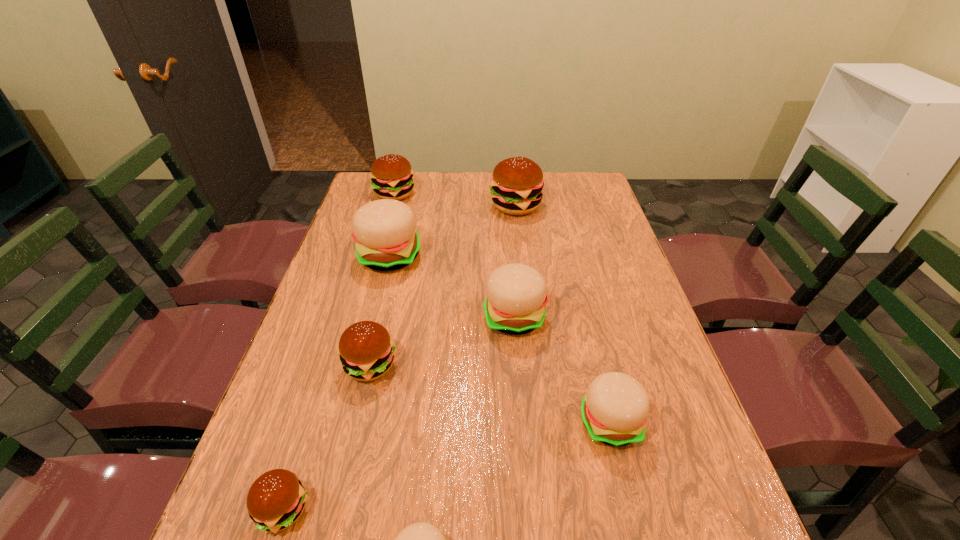
You are a GUI agent. You are given a task and a screenshot of the screen. Output one action in this format:
    pyautogui.click(x=<x>, y=<y>)
    Task: Click on the vacant region that satisfies the following two spatial constraints: 1. on the front side of the second nearest beige hamburger; 2. on the left side of the second biggest brown hamburger
    Image resolution: width=960 pixels, height=540 pixels.
    Given the screenshot: What is the action you would take?
    point(329,422)

I want to click on vacant point that satisfies the following two spatial constraints: 1. on the front side of the third beige hamburger from left to right; 2. on the left side of the farthest beige hamburger, so click(374, 317).

Find the location of a particular element. vacant space that satisfies the following two spatial constraints: 1. on the back side of the second nearest beige hamburger; 2. on the right side of the smallest brown hamburger is located at coordinates (311, 422).

Find the location of a particular element. This screenshot has width=960, height=540. vacant space that satisfies the following two spatial constraints: 1. on the back side of the second biggest brown hamburger; 2. on the left side of the smallest brown hamburger is located at coordinates 384,194.